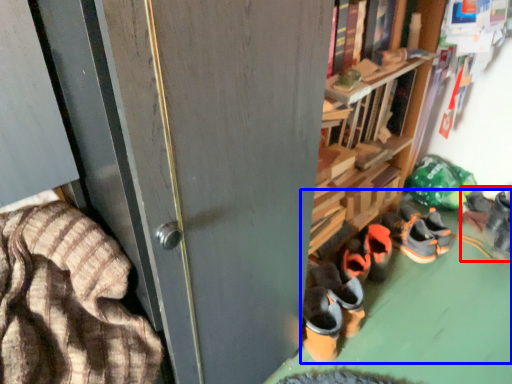
Question: Which object is closer to the camera taking this photo, footwear (highlighted by a red box) or footwear (highlighted by a blue box)?

Choices:
 (A) footwear
 (B) footwear

Answer: (B)